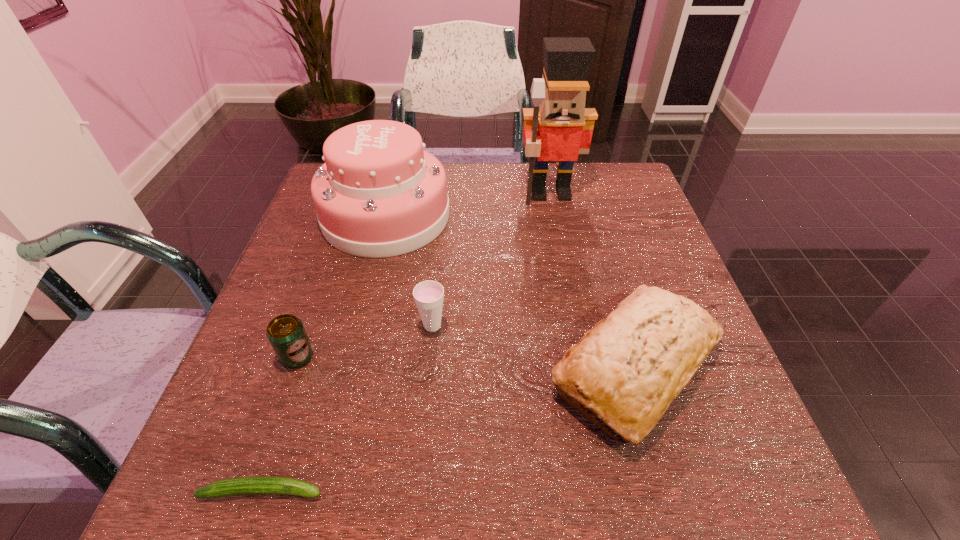
Locate an element on the screen. This screenshot has width=960, height=540. nutcracker present at the right edge is located at coordinates (559, 127).

Where is `bread located in the right edge section of the desktop`? This screenshot has width=960, height=540. bread located in the right edge section of the desktop is located at coordinates point(629,368).

The width and height of the screenshot is (960, 540). I want to click on object present at the far left corner, so click(379, 194).

Image resolution: width=960 pixels, height=540 pixels. Find the location of `object present at the near left corner`. object present at the near left corner is located at coordinates (242, 485).

What are the coordinates of `object positioned at the far right corner` in the screenshot? It's located at (559, 127).

The width and height of the screenshot is (960, 540). I want to click on object present at the near right corner, so click(629, 368).

This screenshot has width=960, height=540. Find the location of `vacant space at the near edge of the desktop`. vacant space at the near edge of the desktop is located at coordinates (477, 448).

In the image, there is a desktop. Identify the location of free space at the left edge. The height and width of the screenshot is (540, 960). (334, 288).

In the image, there is a desktop. Where is `vacant space at the right edge`? The height and width of the screenshot is (540, 960). vacant space at the right edge is located at coordinates (617, 218).

Where is `free point at the far right corner`? free point at the far right corner is located at coordinates (595, 183).